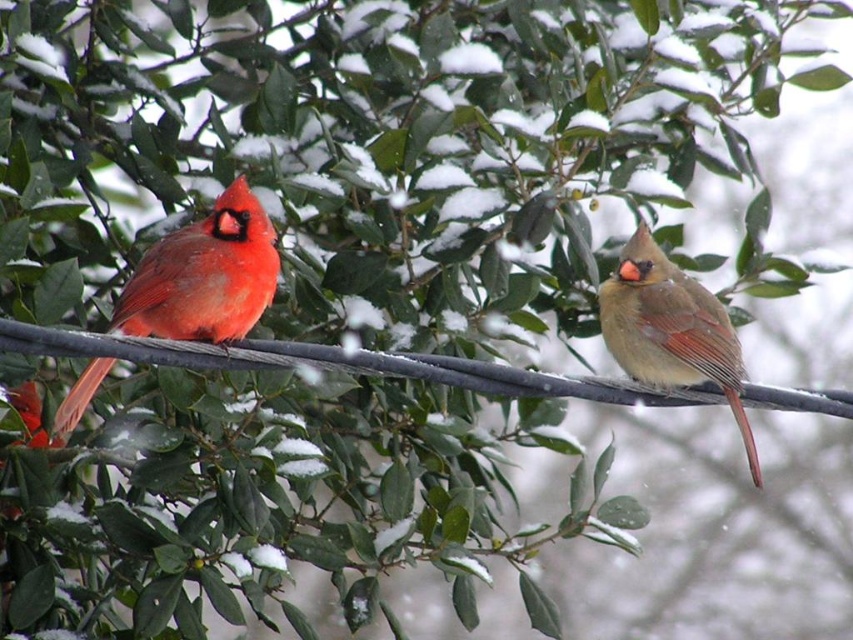
Does matte red cardinal at left have a smaller size compared to matte brown bird at right?

Incorrect, matte red cardinal at left is not smaller in size than matte brown bird at right.

Is point (223, 310) positioned in front of point (637, 260)?

Yes, point (223, 310) is in front of point (637, 260).

This screenshot has width=853, height=640. In order to click on matte red cardinal at left in this screenshot , I will do `click(204, 275)`.